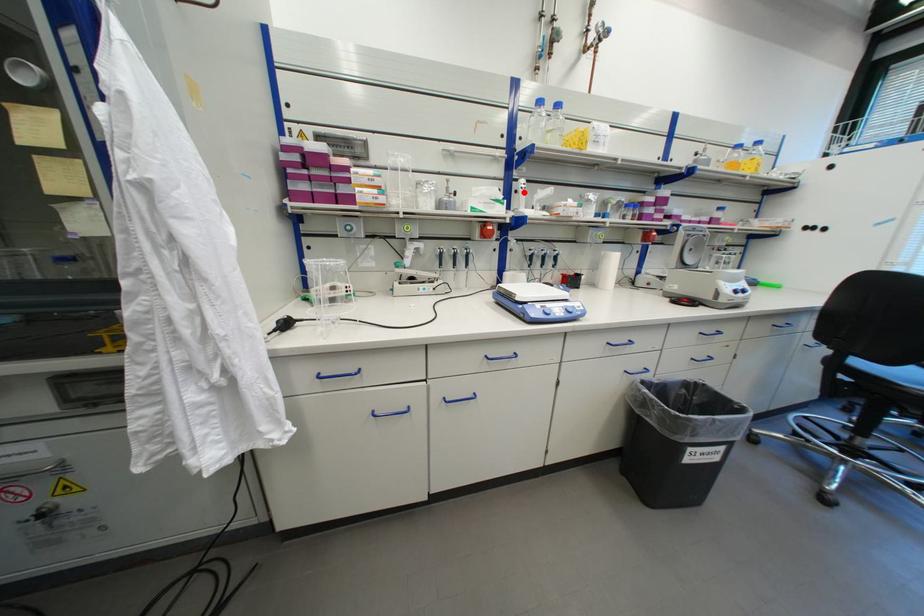
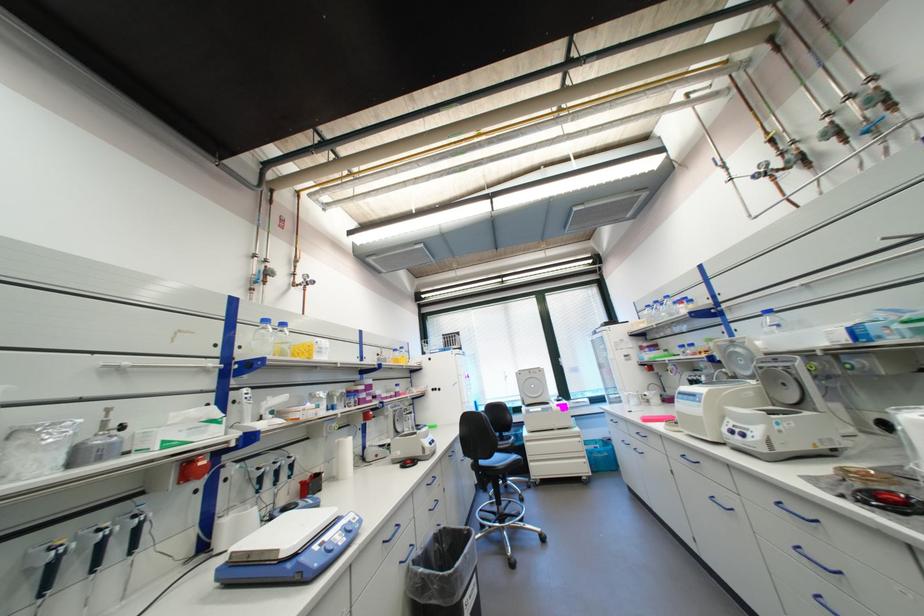
Question: I am providing you with two images of the same scene from different viewpoints. In image1, a red point is highlighted. Considering the same 3D point in image2, which of the following is correct?

Choices:
 (A) It is closer
 (B) It is farther

Answer: (B)